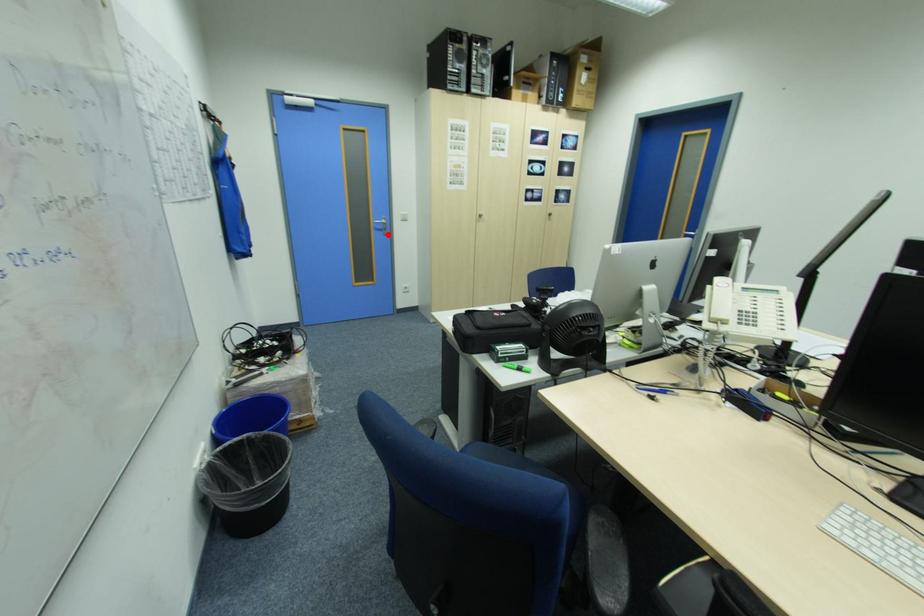
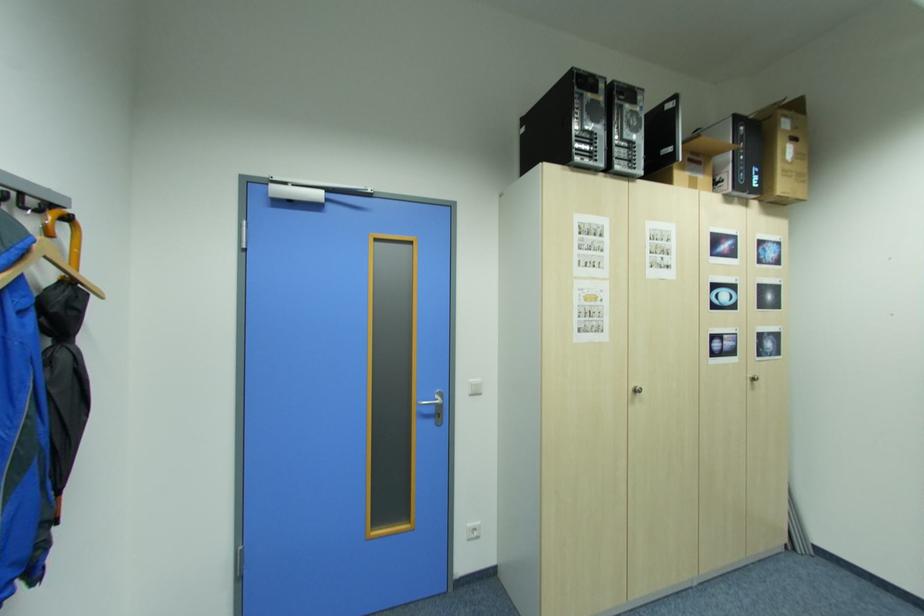
Question: I am providing you with two images of the same scene from different viewpoints. Given a red point in image1, look at the same physical point in image2. Is it:

Choices:
 (A) Closer to the viewpoint
 (B) Farther from the viewpoint

Answer: (B)